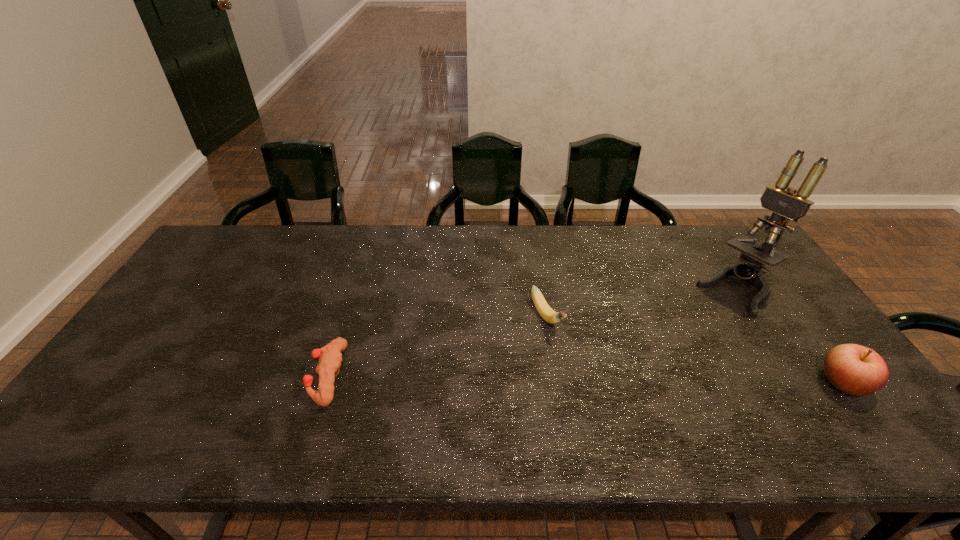
Locate an element on the screen. object at the near right corner is located at coordinates (857, 370).

What are the coordinates of `vacant space at the far edge of the desktop` in the screenshot? It's located at pos(586,266).

The width and height of the screenshot is (960, 540). Find the location of `free region at the near edge`. free region at the near edge is located at coordinates (729, 398).

This screenshot has height=540, width=960. Identify the location of free space at the left edge. (191, 349).

This screenshot has width=960, height=540. In order to click on vacant space at the right edge in this screenshot , I will do `click(793, 366)`.

You are a GUI agent. You are given a task and a screenshot of the screen. Output one action in this format:
    pyautogui.click(x=<x>, y=<y>)
    Task: Click on the vacant region at the far left corner
    This screenshot has width=960, height=540.
    Given the screenshot: What is the action you would take?
    pyautogui.click(x=235, y=257)

What are the coordinates of `free space at the far right corner of the desktop` in the screenshot? It's located at (722, 230).

The image size is (960, 540). What are the coordinates of `free space between the second tallest object and the third tallest object` in the screenshot? It's located at (694, 350).

This screenshot has width=960, height=540. Find the location of `vacant area that lies between the tallest object and the third object from right to left`. vacant area that lies between the tallest object and the third object from right to left is located at coordinates (642, 305).

Locate an element on the screen. vacant point located between the apple and the microscope is located at coordinates (791, 338).